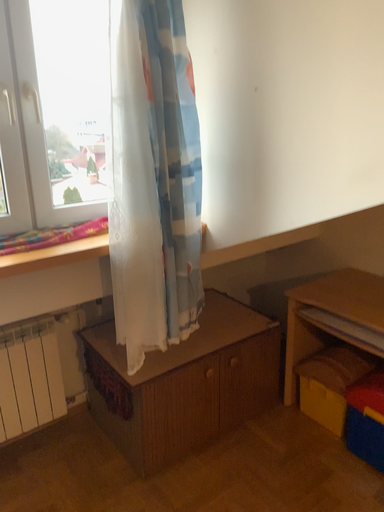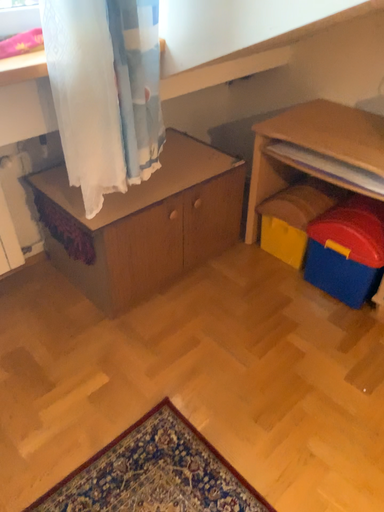
Question: Which way did the camera rotate in the video?

Choices:
 (A) rotated right
 (B) rotated left

Answer: (A)